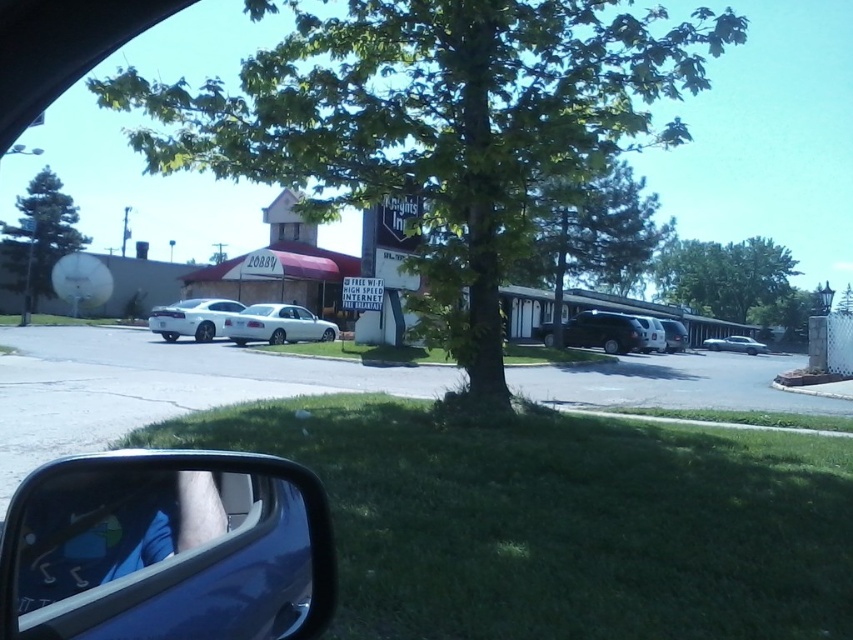
Question: Is glossy plastic side mirror at lower left wider than white glossy car window at center?

Choices:
 (A) no
 (B) yes

Answer: (A)

Question: Which of the following is the farthest from the observer?

Choices:
 (A) (79, 548)
 (B) (289, 308)

Answer: (B)

Question: Among these points, which one is nearest to the camera?

Choices:
 (A) (161, 636)
 (B) (50, 262)
 (C) (277, 330)

Answer: (A)

Question: Can you confirm if green leafy tree at upper center is wider than satin black suv at center?

Choices:
 (A) yes
 (B) no

Answer: (A)

Question: Based on their relative distances, which object is farther from the white glossy car window at center?

Choices:
 (A) white glossy sedan at center
 (B) green leafy tree at upper center

Answer: (B)

Question: Is glossy plastic side mirror at lower left below satin silver sedan at center?

Choices:
 (A) no
 (B) yes

Answer: (B)